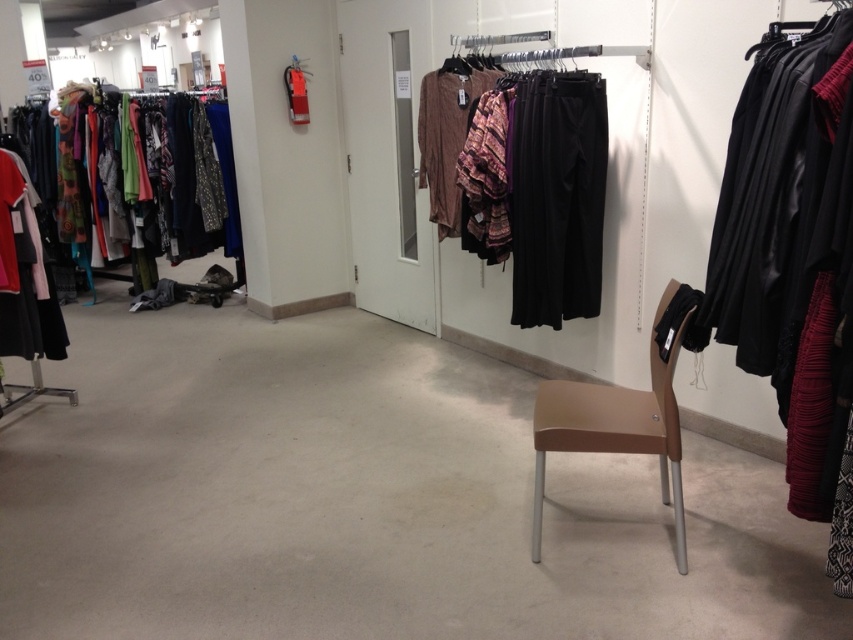
Question: Does matte black pants at center have a larger size compared to black leather jacket at right?

Choices:
 (A) no
 (B) yes

Answer: (B)

Question: Among these objects, which one is nearest to the camera?

Choices:
 (A) matte black dress at left
 (B) brown plastic chair at lower right
 (C) black leather jacket at right

Answer: (C)

Question: Which point is closer to the camera?

Choices:
 (A) (722, 266)
 (B) (16, 348)
 (C) (584, 268)
 (D) (172, 189)

Answer: (A)

Question: Which object is farther from the camera taking this photo?

Choices:
 (A) matte black pants at center
 (B) black leather jacket at right
 (C) brown plastic chair at lower right

Answer: (A)

Question: Can you confirm if matte black clothing rack at left is positioned above brown plastic chair at lower right?

Choices:
 (A) no
 (B) yes

Answer: (B)

Question: Is matte black pants at center further to camera compared to matte black dress at left?

Choices:
 (A) yes
 (B) no

Answer: (B)